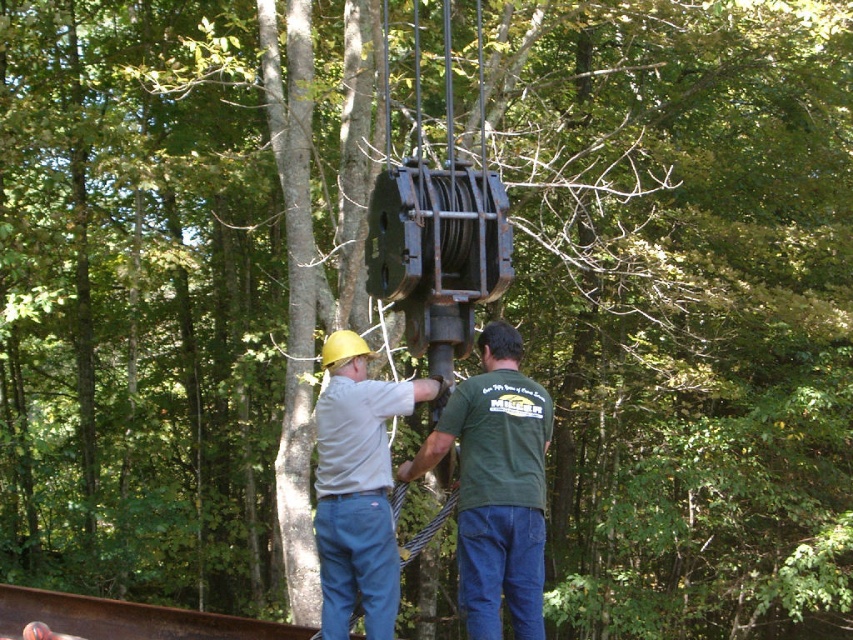
You are standing in the wooded area and looking at the two points marked on the pulley mechanism. Which point, point (525, 579) or point (434, 390), is closer to you?

Point (525, 579) is closer to the viewer than point (434, 390).

You are a safety inspector assessing the scene. You notice a point marked at coordinates (496, 486). What object is located at this point?

The point at coordinates (496, 486) marks the green matte shirt at center.

You are standing at the origin point in the scene. You need to locate the green matte shirt at center. In which direction should you move to reach it?

The green matte shirt at center is located at point 0.761 on the x axis and 0.583 on the y axis. Since the origin is at the bottom left corner, you should move to the right and slightly upward to reach it.